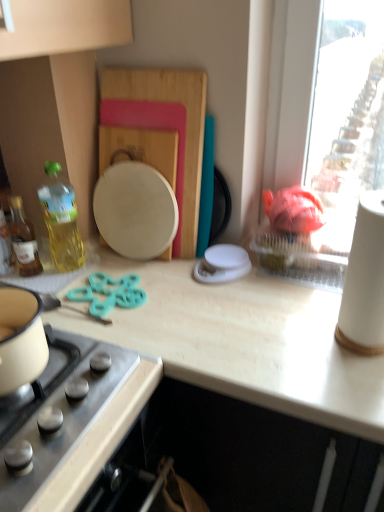
Where is `free area below teal plastic scissors at center (from a real-world perspective)`? The image size is (384, 512). free area below teal plastic scissors at center (from a real-world perspective) is located at coordinates (106, 303).